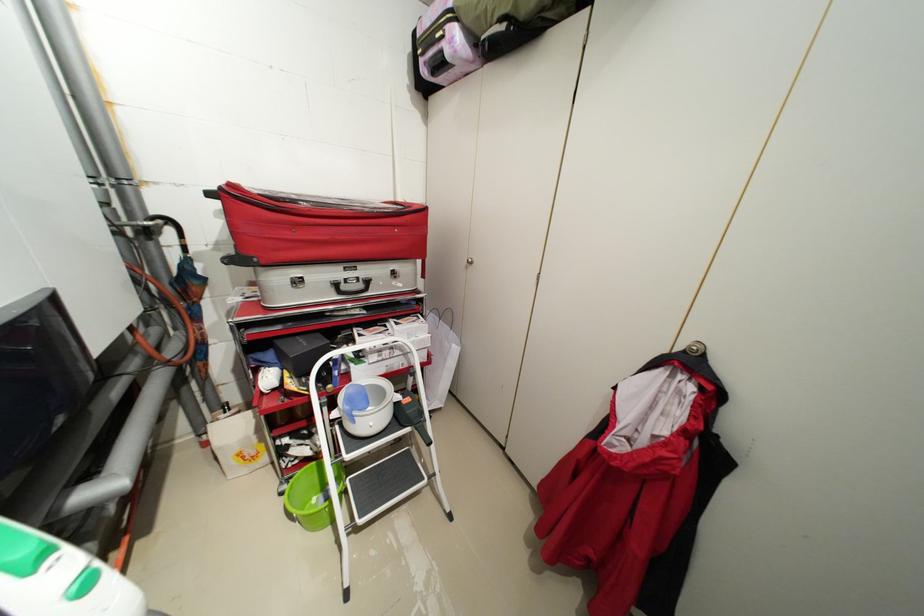
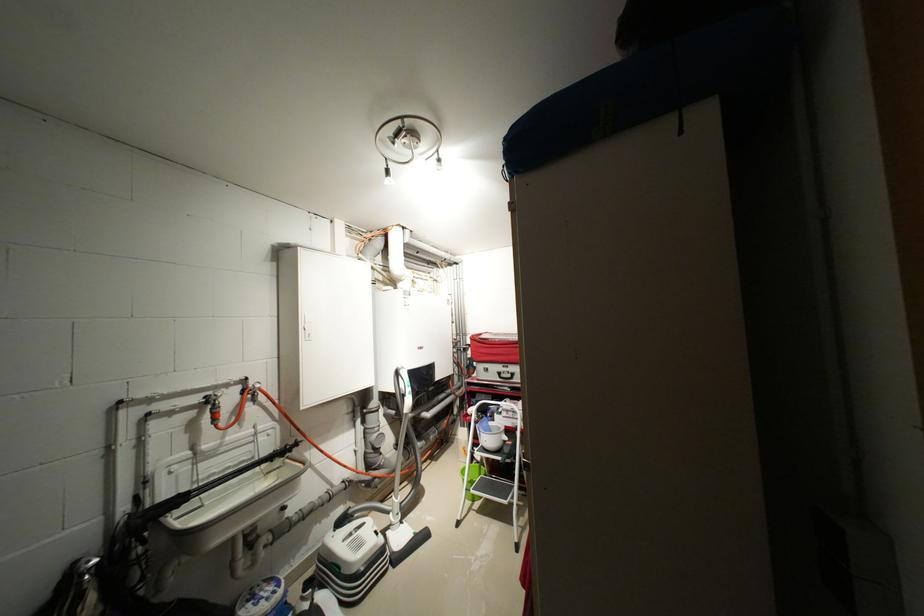
Locate, in the second image, the point that corresponds to point 386,352 in the first image.

(515, 411)